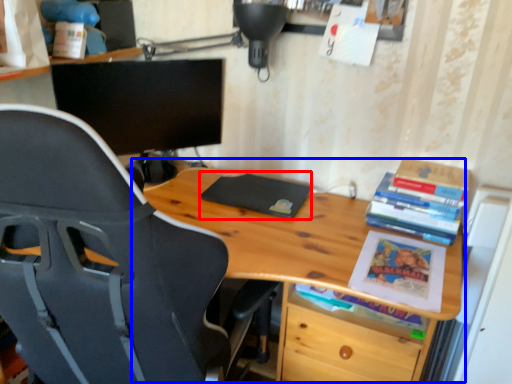
Question: Which of the following is the farthest to the observer, paperback book (highlighted by a red box) or table (highlighted by a blue box)?

Choices:
 (A) paperback book
 (B) table

Answer: (A)